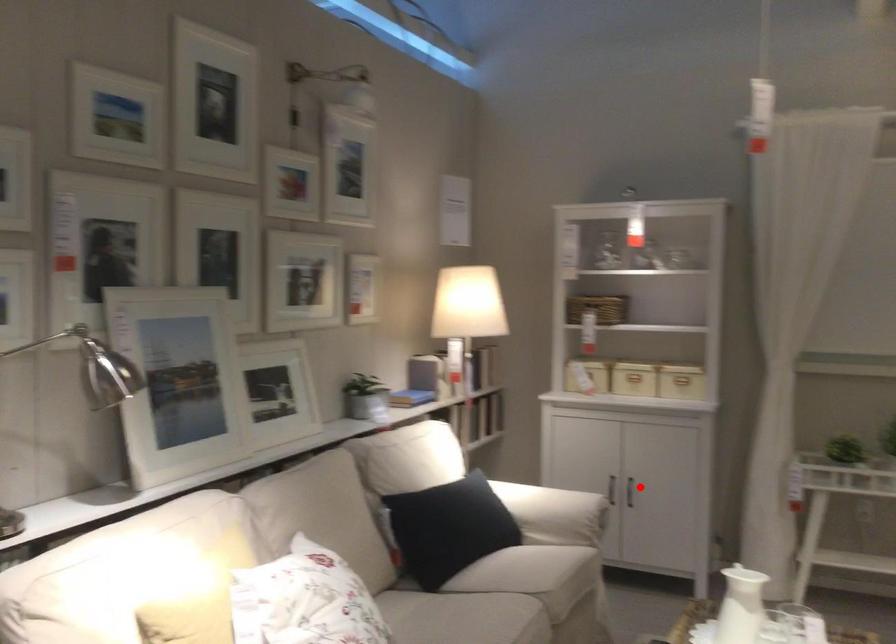
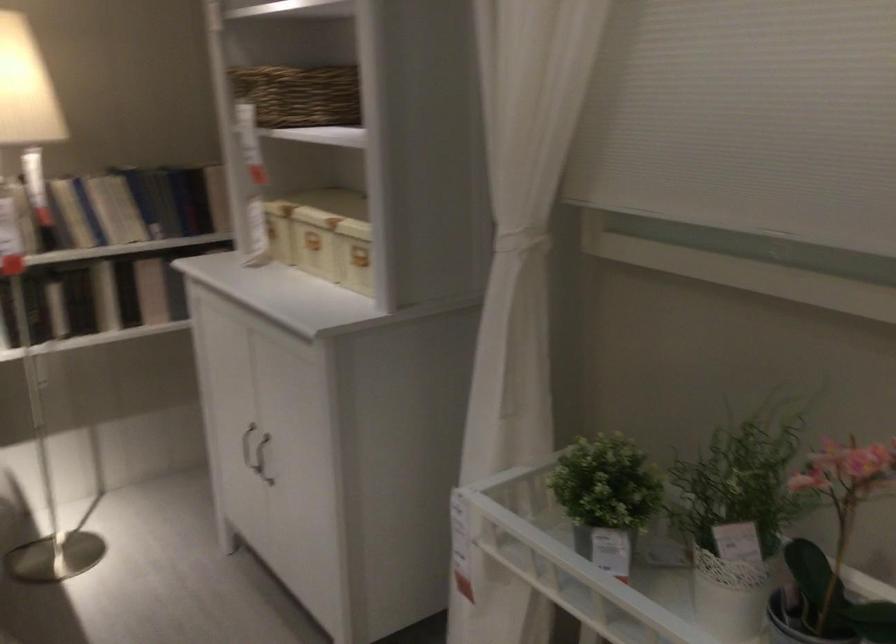
In the second image, find the point that corresponds to the highlighted location in the first image.

(262, 459)